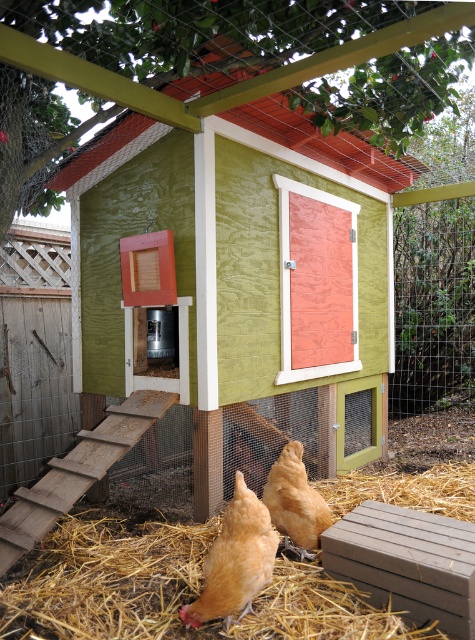
You are a farmer checking the coop. You need to place a 1.2 meter wide hay bale between the yellow straw at lower center and the golden feathered chicken at center. Is there enough space?

The yellow straw at lower center is wider than the golden feathered chicken at center. However, the exact distance between them isn not specified in the objects description. Therefore, it is uncertain if the 1.2 meter wide hay bale can fit between them.

Consider the image. You are standing at the point labeled as point (240, 291). Based on the scene description, can you tell me which object you are currently touching?

The point (240, 291) is on the green plywood chicken coop at center, so you are touching the green plywood chicken coop at center.

You are a farmer checking the chickens. You see the golden feathered chicken at lower center and the green plywood chicken coop at center. Which one is closer to you?

The green plywood chicken coop at center is closer to you because the golden feathered chicken at lower center is behind it.